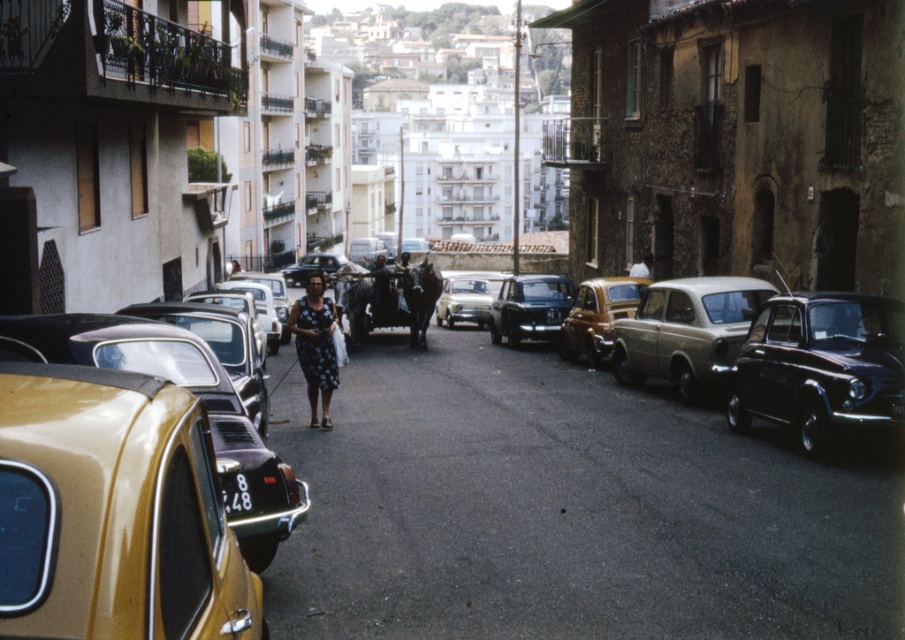
Question: From the image, what is the correct spatial relationship of shiny silver car at center in relation to white fabric bag at center?

Choices:
 (A) above
 (B) below

Answer: (B)

Question: Can you confirm if matte black car at center is smaller than black plastic license plate at center?

Choices:
 (A) yes
 (B) no

Answer: (B)

Question: Which point is farther to the camera?

Choices:
 (A) gold metallic taxi at left
 (B) matte yellow taxi at center
 (C) matte black car at center

Answer: (C)

Question: Which object is the farthest from the matte yellow taxi at center?

Choices:
 (A) black plastic license plate at center
 (B) white fabric bag at center

Answer: (A)

Question: Can you confirm if gold metallic taxi at left is bigger than matte yellow taxi at center?

Choices:
 (A) yes
 (B) no

Answer: (B)

Question: Which point appears closest to the camera in this image?

Choices:
 (A) (486, 280)
 (B) (513, 276)
 (C) (299, 312)

Answer: (C)